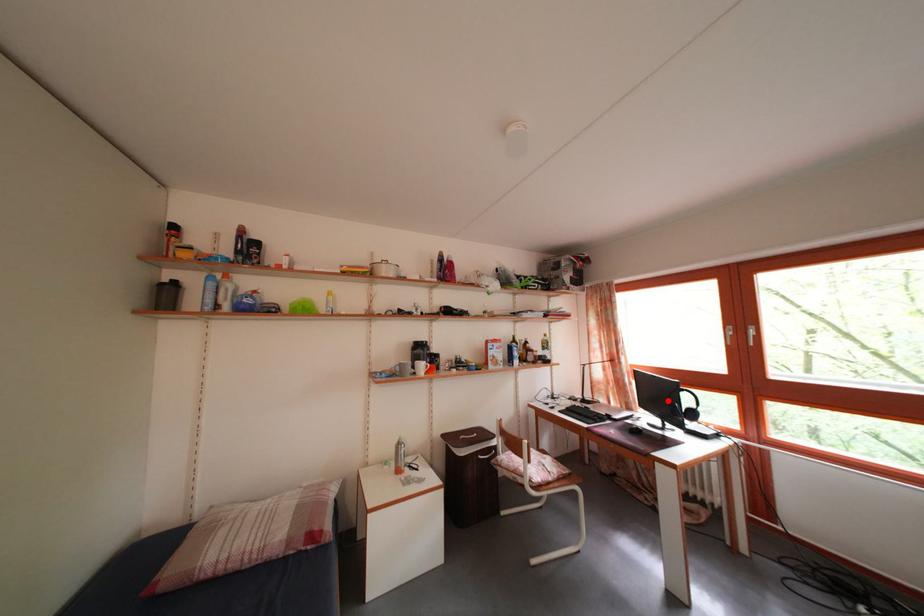
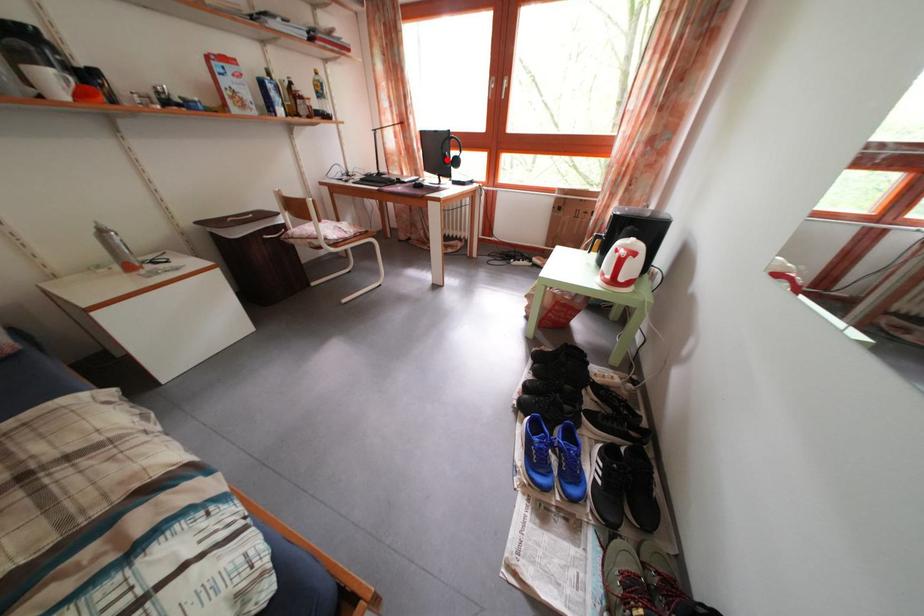
I am providing you with two images of the same scene from different viewpoints. A red point is marked on the first image and another point is marked on the second image. Do the highlighted points in image1 and image2 indicate the same real-world spot?

Yes